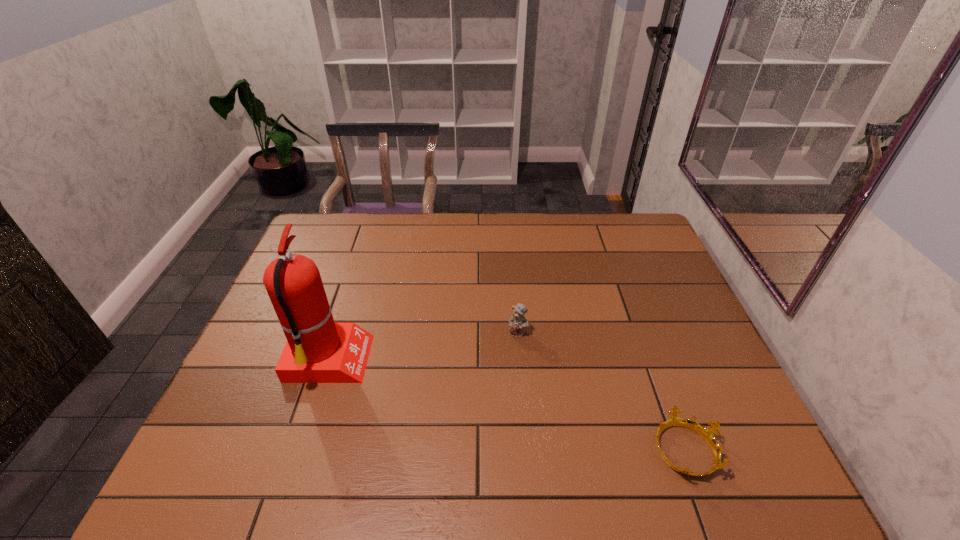
Where is `object positioned at the left edge`? The height and width of the screenshot is (540, 960). object positioned at the left edge is located at coordinates (318, 350).

The image size is (960, 540). In order to click on object present at the right edge in this screenshot , I will do pos(707,433).

Where is `object that is at the near right corner`? The width and height of the screenshot is (960, 540). object that is at the near right corner is located at coordinates (707, 433).

In the image, there is a desktop. At what (x,y) coordinates should I click in order to perform the action: click on vacant space at the far edge. Please return your answer as a coordinate pair (x, y). This screenshot has height=540, width=960. Looking at the image, I should click on (577, 231).

At what (x,y) coordinates should I click in order to perform the action: click on free space at the near edge of the desktop. Please return your answer as a coordinate pair (x, y). The image size is (960, 540). Looking at the image, I should click on (628, 462).

At what (x,y) coordinates should I click in order to perform the action: click on free space at the left edge of the desktop. Please return your answer as a coordinate pair (x, y). The width and height of the screenshot is (960, 540). Looking at the image, I should click on (329, 256).

In the image, there is a desktop. At what (x,y) coordinates should I click in order to perform the action: click on blank space at the right edge. Please return your answer as a coordinate pair (x, y). The image size is (960, 540). Looking at the image, I should click on (644, 301).

This screenshot has width=960, height=540. I want to click on vacant area at the far left corner, so click(x=339, y=252).

Locate an element on the screen. vacant space at the far right corner is located at coordinates point(621,233).

This screenshot has height=540, width=960. In the image, there is a desktop. In order to click on vacant space at the near right corner in this screenshot , I will do `click(757, 477)`.